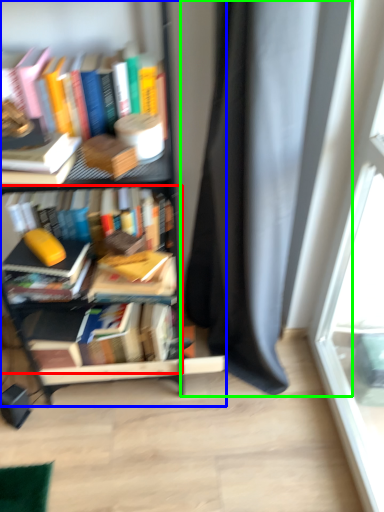
Question: Which object is the farthest from book (highlighted by a red box)? Choose among these: bookcase (highlighted by a blue box) or curtain (highlighted by a green box).

Choices:
 (A) bookcase
 (B) curtain

Answer: (B)